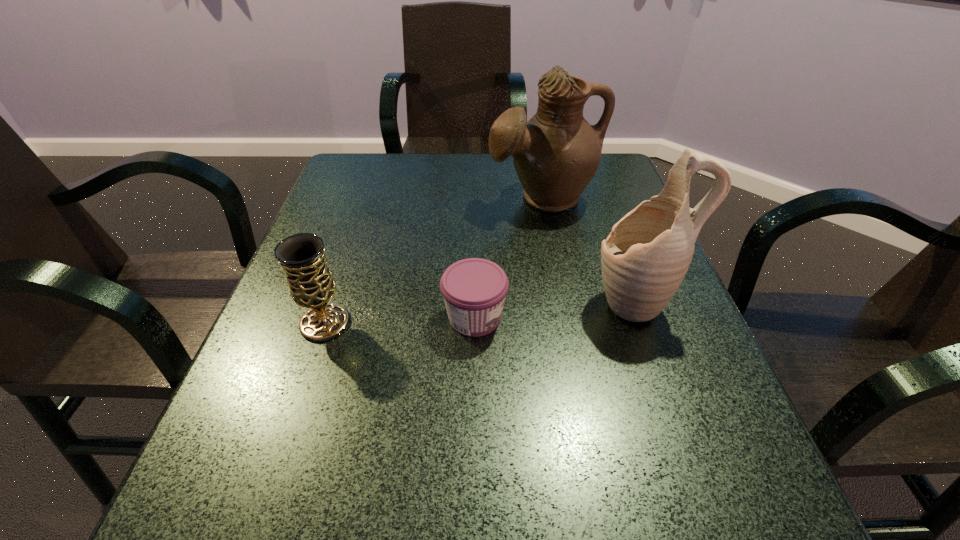
Find the location of a particular element. The image size is (960, 540). vacant position located on the front label of the jam is located at coordinates (692, 317).

The width and height of the screenshot is (960, 540). I want to click on object that is at the far edge, so click(556, 154).

At what (x,y) coordinates should I click in order to perform the action: click on object present at the left edge. Please return your answer as a coordinate pair (x, y). The image size is (960, 540). Looking at the image, I should click on (311, 284).

Locate an element on the screen. The image size is (960, 540). object located at the far right corner is located at coordinates (556, 154).

The width and height of the screenshot is (960, 540). I want to click on free space at the far edge, so click(x=448, y=193).

Find the location of a particular element. This screenshot has height=540, width=960. free point at the left edge is located at coordinates (322, 228).

You are a GUI agent. You are given a task and a screenshot of the screen. Output one action in this format:
    pyautogui.click(x=<x>, y=<y>)
    Task: Click on the vacant space at the right edge of the desktop
    The image size is (960, 540).
    Given the screenshot: What is the action you would take?
    pyautogui.click(x=603, y=214)

This screenshot has width=960, height=540. Find the location of `vacant space at the far left corner of the desktop`. vacant space at the far left corner of the desktop is located at coordinates (387, 178).

Find the location of a particular element. The width and height of the screenshot is (960, 540). free space at the near left corner of the desktop is located at coordinates (193, 484).

You are a GUI agent. You are given a task and a screenshot of the screen. Output one action in this format:
    pyautogui.click(x=<x>, y=<y>)
    Task: Click on the vacant space that's between the jam and the farthest object
    
    Given the screenshot: What is the action you would take?
    pyautogui.click(x=509, y=258)